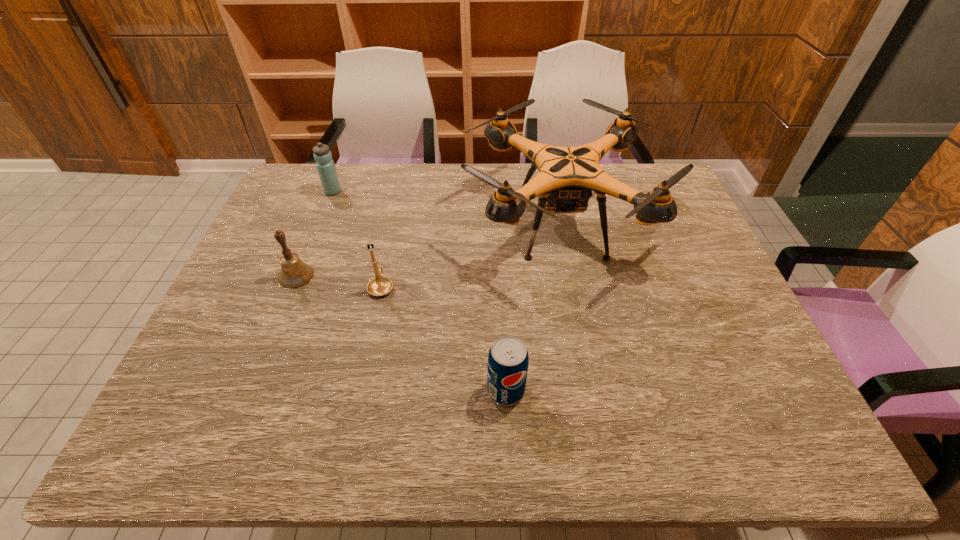
Image resolution: width=960 pixels, height=540 pixels. I want to click on the tallest object, so click(x=567, y=176).

The height and width of the screenshot is (540, 960). Identify the location of water bottle. (325, 165).

Find the location of `bell`. bell is located at coordinates (294, 273).

I want to click on the third object from left to right, so click(379, 286).

The width and height of the screenshot is (960, 540). In order to click on pop in this screenshot , I will do `click(508, 359)`.

At what (x,y) coordinates should I click in order to perform the action: click on vacant space located on the camera mount of the drone. Please return your answer as a coordinate pair (x, y). Looking at the image, I should click on click(x=332, y=224).

Identify the location of free space located on the camera mount of the drone. (421, 224).

Image resolution: width=960 pixels, height=540 pixels. What are the coordinates of `vacant space situated on the camera mount of the drone` in the screenshot? It's located at (346, 224).

At what (x,y) coordinates should I click in order to perform the action: click on vacant space located 0.390m on the front of the water bottle. Please return your answer as a coordinate pair (x, y). Looking at the image, I should click on (297, 284).

Where is `vacant space located 0.070m on the left of the bell`? This screenshot has height=540, width=960. vacant space located 0.070m on the left of the bell is located at coordinates (253, 276).